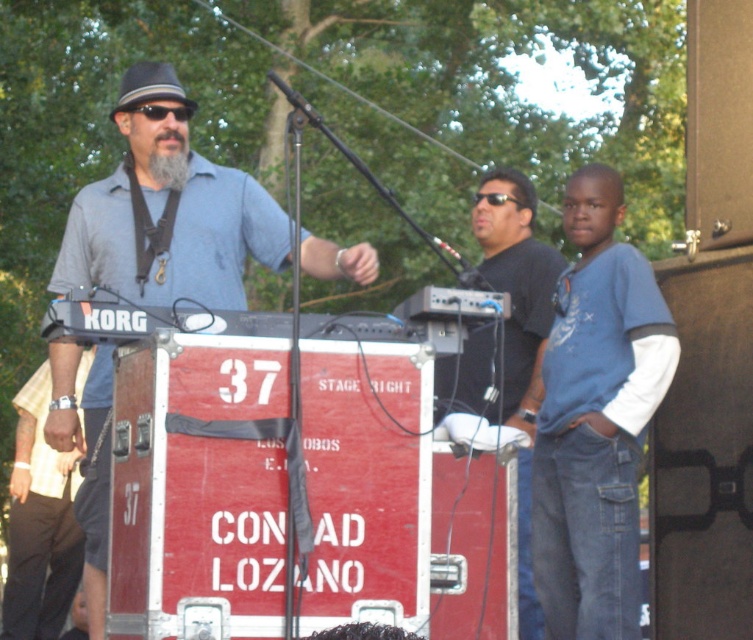
Who is taller, brown leather wristwatch at left or gray felt fedora at upper left?

brown leather wristwatch at left is taller.

Locate an element on the screen. brown leather wristwatch at left is located at coordinates (38, 524).

Find the location of `brown leather wristwatch at left`. brown leather wristwatch at left is located at coordinates (38, 524).

Describe the element at coordinates (596, 419) in the screenshot. The height and width of the screenshot is (640, 753). I see `blue cotton shirt at right` at that location.

Locate an element on the screen. The height and width of the screenshot is (640, 753). blue cotton shirt at right is located at coordinates tap(596, 419).

Which is in front, point (517, 376) or point (154, 92)?

Point (154, 92) is more forward.

Locate an element on the screen. The height and width of the screenshot is (640, 753). matte black shirt at center is located at coordinates (511, 310).

Is point (535, 609) farther from viewer compared to point (136, 83)?

Yes, it is behind point (136, 83).

Locate an element on the screen. matte black shirt at center is located at coordinates (511, 310).